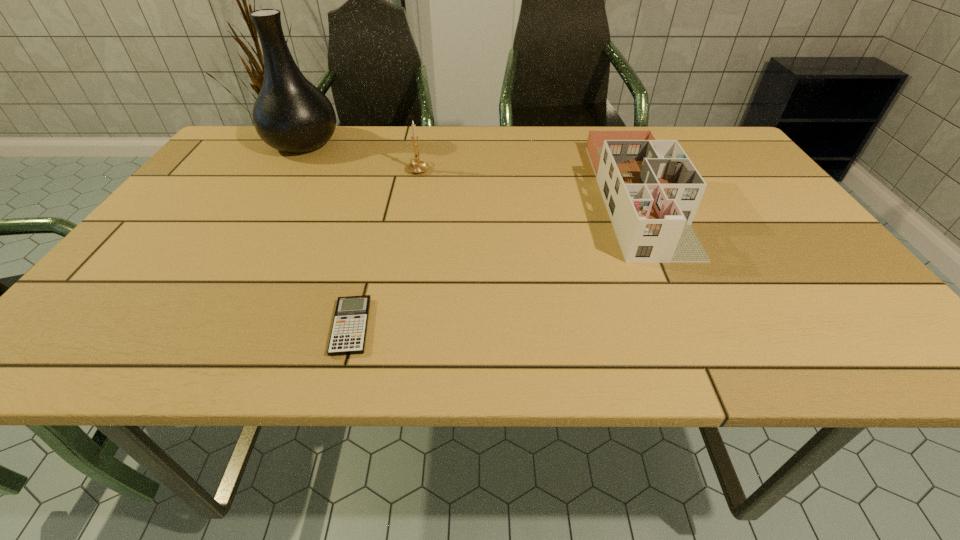
Find the location of `the leftmost object`. the leftmost object is located at coordinates (290, 114).

At what (x,y) coordinates should I click in order to perform the action: click on vase. Please return your answer as a coordinate pair (x, y). The width and height of the screenshot is (960, 540). Looking at the image, I should click on (290, 114).

The image size is (960, 540). In order to click on the third object from left to right in this screenshot , I will do `click(416, 166)`.

This screenshot has width=960, height=540. In order to click on the third shortest object in this screenshot , I will do `click(416, 166)`.

Where is `dollhouse`? dollhouse is located at coordinates (651, 189).

I want to click on the third tallest object, so click(651, 189).

Find the location of a particular element. This screenshot has height=540, width=960. the nearest object is located at coordinates (348, 335).

I want to click on the shortest object, so click(348, 335).

Identify the location of vacant space located 0.180m on the right of the tallest object. 402,144.

Find the location of a particular element. The width and height of the screenshot is (960, 540). vacant space located 0.170m on the handle side of the third shortest object is located at coordinates (425, 133).